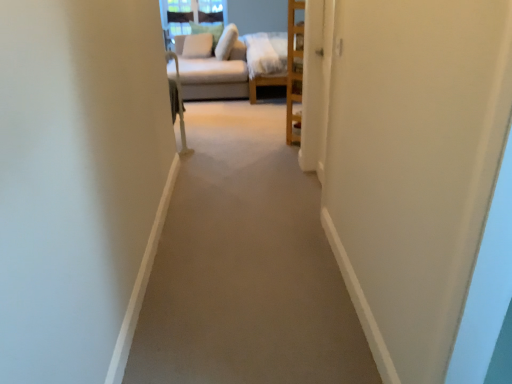
Question: Which direction should I rotate to face white soft pillow at upper center, placed as the third pillow when sorted from left to right, — up or down?

Choices:
 (A) down
 (B) up

Answer: (B)

Question: Does carpet at center have a greater width compared to light beige fabric pillow at upper center, which ranks as the second pillow in right-to-left order?

Choices:
 (A) yes
 (B) no

Answer: (A)

Question: Does carpet at center lie behind light beige fabric pillow at upper center, which ranks as the second pillow in right-to-left order?

Choices:
 (A) yes
 (B) no

Answer: (B)

Question: Is carpet at center bigger than light beige fabric pillow at upper center, the second pillow viewed from the left?

Choices:
 (A) yes
 (B) no

Answer: (B)

Question: Does carpet at center have a lesser width compared to light beige fabric pillow at upper center, which ranks as the second pillow in right-to-left order?

Choices:
 (A) yes
 (B) no

Answer: (B)

Question: Is carpet at center directly adjacent to light beige fabric pillow at upper center, which ranks as the second pillow in right-to-left order?

Choices:
 (A) no
 (B) yes

Answer: (A)

Question: Would you say carpet at center contains light beige fabric pillow at upper center, the second pillow viewed from the left?

Choices:
 (A) yes
 (B) no

Answer: (B)

Question: From the image's perspective, is beige fabric couch at upper center under white soft pillow at upper center, the 3th pillow viewed from the right?

Choices:
 (A) no
 (B) yes

Answer: (B)

Question: Considering the relative sizes of beige fabric couch at upper center and white soft pillow at upper center, the 1th pillow from the left, in the image provided, is beige fabric couch at upper center smaller than white soft pillow at upper center, the 1th pillow from the left,?

Choices:
 (A) no
 (B) yes

Answer: (A)

Question: From a real-world perspective, is beige fabric couch at upper center below white soft pillow at upper center, the 3th pillow viewed from the right?

Choices:
 (A) yes
 (B) no

Answer: (A)

Question: Is beige fabric couch at upper center facing away from white soft pillow at upper center, the 1th pillow from the left?

Choices:
 (A) yes
 (B) no

Answer: (B)

Question: Is the position of beige fabric couch at upper center more distant than that of white soft pillow at upper center, the 3th pillow viewed from the right?

Choices:
 (A) yes
 (B) no

Answer: (B)

Question: Considering the relative positions of beige fabric couch at upper center and white soft pillow at upper center, the 3th pillow viewed from the right, in the image provided, is beige fabric couch at upper center to the left of white soft pillow at upper center, the 3th pillow viewed from the right, from the viewer's perspective?

Choices:
 (A) no
 (B) yes

Answer: (A)

Question: Can you confirm if carpet at center is shorter than white soft pillow at upper center, which is the 1th pillow from right to left?

Choices:
 (A) no
 (B) yes

Answer: (B)